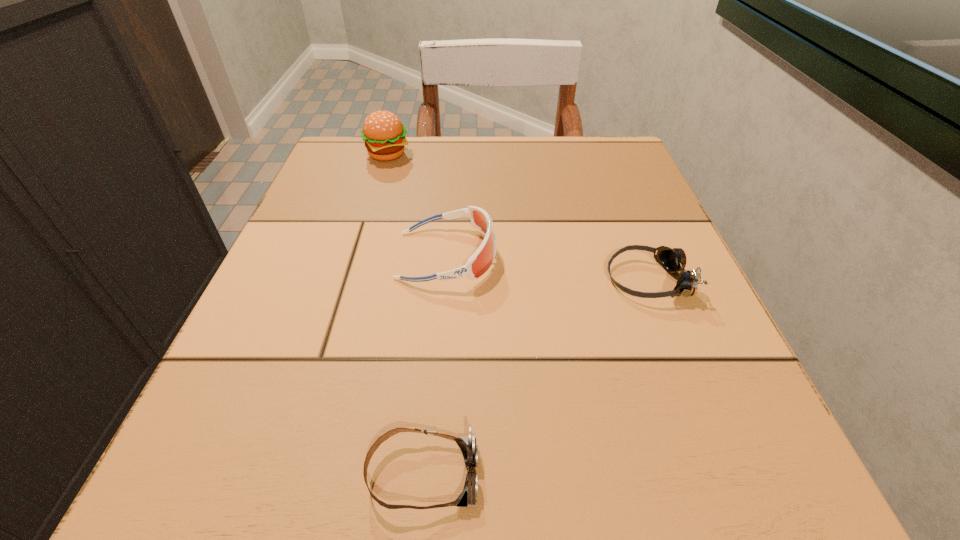
Where is `vacant region between the shortest object and the farthest object`? This screenshot has height=540, width=960. vacant region between the shortest object and the farthest object is located at coordinates (405, 314).

Where is `empty space that is in between the nearest object and the second tallest object`? The width and height of the screenshot is (960, 540). empty space that is in between the nearest object and the second tallest object is located at coordinates (435, 365).

You are a GUI agent. You are given a task and a screenshot of the screen. Output one action in this format:
    pyautogui.click(x=<x>, y=<y>)
    Task: Click on the vacant space in between the nearest goggles and the tallest goggles
    The width and height of the screenshot is (960, 540).
    Given the screenshot: What is the action you would take?
    pyautogui.click(x=435, y=365)

The width and height of the screenshot is (960, 540). In order to click on object that is the nearest to the tallest goggles in this screenshot , I will do `click(672, 260)`.

Choose which object is the nearest neighbor to the tallest object. Please provide its 2D coordinates. Your answer should be formatted as a tuple, i.e. [(x, y)], where the tuple contains the x and y coordinates of a point satisfying the conditions above.

[(482, 259)]

Identify the location of goggles that can be found as the closest to the rightmost object. Image resolution: width=960 pixels, height=540 pixels. (482, 259).

Locate which goggles ranks second in proximity to the rightmost object. Please provide its 2D coordinates. Your answer should be formatted as a tuple, i.e. [(x, y)], where the tuple contains the x and y coordinates of a point satisfying the conditions above.

[(467, 445)]